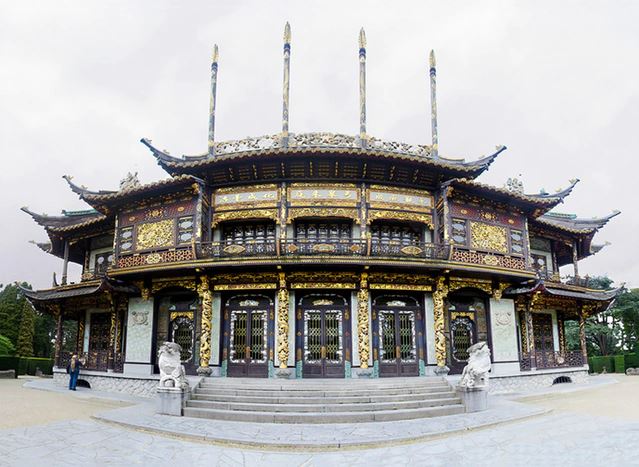
Image resolution: width=639 pixels, height=467 pixels. What are the coordinates of `grate` in the screenshot? It's located at (560, 377), (82, 381).